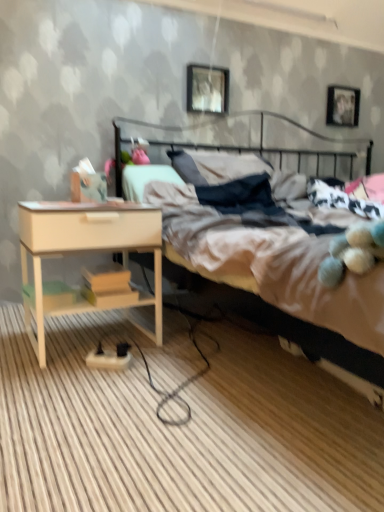
Question: Is metallic silver picture frame at upper center, which appears as the 2th picture frame when viewed from the back, taller than metallic silver picture frame at upper right, acting as the second picture frame starting from the front?

Choices:
 (A) yes
 (B) no

Answer: (B)

Question: Considering the relative sizes of metallic silver picture frame at upper center, positioned as the 1th picture frame in left-to-right order, and metallic silver picture frame at upper right, acting as the second picture frame starting from the front, in the image provided, is metallic silver picture frame at upper center, positioned as the 1th picture frame in left-to-right order, bigger than metallic silver picture frame at upper right, acting as the second picture frame starting from the front,?

Choices:
 (A) yes
 (B) no

Answer: (A)

Question: Does metallic silver picture frame at upper center, acting as the 1th picture frame starting from the front, have a greater width compared to metallic silver picture frame at upper right, which appears as the second picture frame when viewed from the left?

Choices:
 (A) yes
 (B) no

Answer: (A)

Question: Considering the relative sizes of metallic silver picture frame at upper center, which appears as the 2th picture frame when viewed from the back, and metallic silver picture frame at upper right, which is the 1th picture frame from right to left, in the image provided, is metallic silver picture frame at upper center, which appears as the 2th picture frame when viewed from the back, shorter than metallic silver picture frame at upper right, which is the 1th picture frame from right to left,?

Choices:
 (A) yes
 (B) no

Answer: (A)

Question: From a real-world perspective, is metallic silver picture frame at upper center, which appears as the 2th picture frame when viewed from the back, located higher than metallic silver picture frame at upper right, which appears as the second picture frame when viewed from the left?

Choices:
 (A) yes
 (B) no

Answer: (B)

Question: Relative to metallic bed at center, is metallic black headboard at upper center in front or behind?

Choices:
 (A) front
 (B) behind

Answer: (B)

Question: In the image, is metallic black headboard at upper center on the left side or the right side of metallic bed at center?

Choices:
 (A) right
 (B) left

Answer: (B)

Question: From a real-world perspective, is metallic black headboard at upper center physically located above or below metallic bed at center?

Choices:
 (A) below
 (B) above

Answer: (B)

Question: Looking at their shapes, would you say metallic black headboard at upper center is wider or thinner than metallic bed at center?

Choices:
 (A) wide
 (B) thin

Answer: (B)

Question: In terms of width, does metallic black headboard at upper center look wider or thinner when compared to metallic silver picture frame at upper center, positioned as the second picture frame in right-to-left order?

Choices:
 (A) thin
 (B) wide

Answer: (B)

Question: Looking at the image, does metallic black headboard at upper center seem bigger or smaller compared to metallic silver picture frame at upper center, positioned as the 1th picture frame in left-to-right order?

Choices:
 (A) small
 (B) big

Answer: (B)

Question: Is metallic black headboard at upper center in front of or behind metallic silver picture frame at upper center, acting as the 1th picture frame starting from the front, in the image?

Choices:
 (A) front
 (B) behind

Answer: (A)

Question: From the image's perspective, relative to metallic silver picture frame at upper center, acting as the 1th picture frame starting from the front, is metallic black headboard at upper center above or below?

Choices:
 (A) above
 (B) below

Answer: (B)

Question: Is point (352, 331) positioned closer to the camera than point (306, 160)?

Choices:
 (A) closer
 (B) farther

Answer: (A)

Question: Considering the positions of metallic bed at center and metallic black headboard at upper center in the image, is metallic bed at center taller or shorter than metallic black headboard at upper center?

Choices:
 (A) tall
 (B) short

Answer: (A)